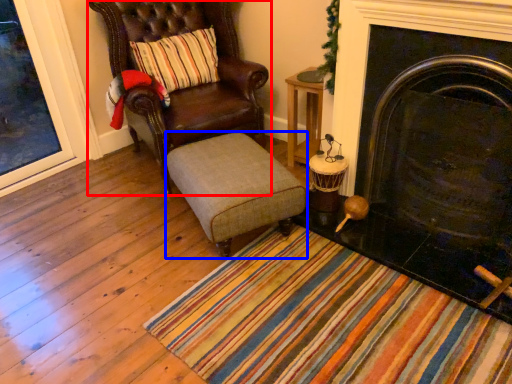
Question: Which of the following is the closest to the observer, chair (highlighted by a red box) or stool (highlighted by a blue box)?

Choices:
 (A) chair
 (B) stool

Answer: (B)